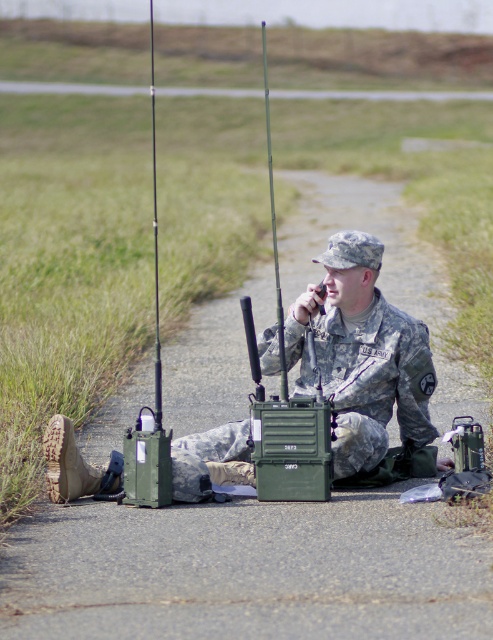
Question: Which of the following is the closest to the observer?

Choices:
 (A) (153, 170)
 (B) (276, 269)

Answer: (B)

Question: Is metallic silver pole at center to the right of green plastic fishing pole at center from the viewer's perspective?

Choices:
 (A) yes
 (B) no

Answer: (A)

Question: Is metallic silver pole at center below green plastic fishing pole at center?

Choices:
 (A) no
 (B) yes

Answer: (A)

Question: Which point appears closest to the camera in this image?

Choices:
 (A) (272, 166)
 (B) (157, 278)

Answer: (B)

Question: Which object appears farthest from the camera in this image?

Choices:
 (A) green plastic fishing pole at center
 (B) camouflage fabric uniform at center
 (C) metallic silver pole at center

Answer: (C)

Question: Is camouflage fabric uniform at center closer to camera compared to green plastic fishing pole at center?

Choices:
 (A) yes
 (B) no

Answer: (B)